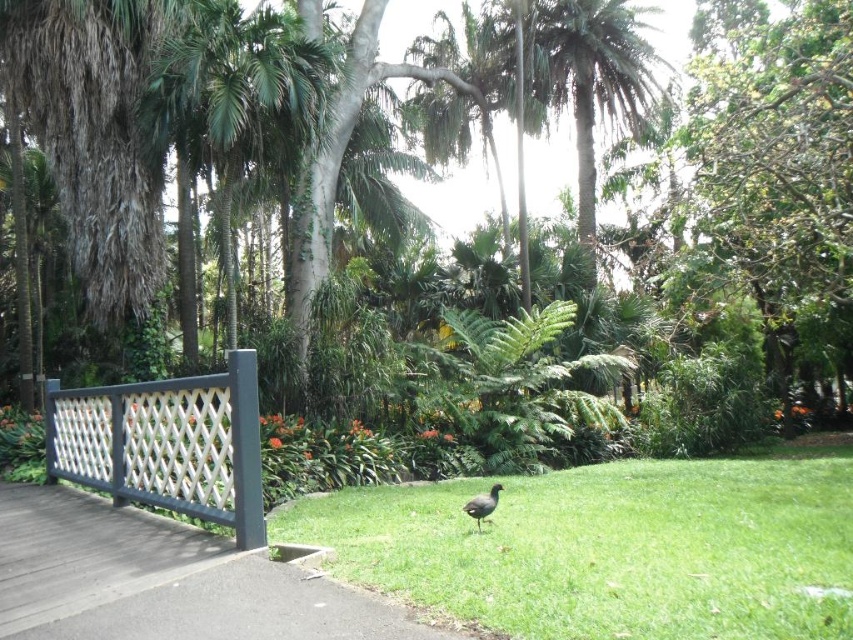
Does green grass at center have a lesser width compared to brown matte bird at center?

In fact, green grass at center might be wider than brown matte bird at center.

Can you confirm if green grass at center is bigger than brown matte bird at center?

Yes.

This screenshot has width=853, height=640. Describe the element at coordinates (610, 547) in the screenshot. I see `green grass at center` at that location.

The height and width of the screenshot is (640, 853). I want to click on green grass at center, so click(x=610, y=547).

The image size is (853, 640). Describe the element at coordinates (166, 444) in the screenshot. I see `white lattice fence at left` at that location.

Does point (149, 484) lie behind point (488, 496)?

Yes, it is behind point (488, 496).

Is point (256, 428) positioned in front of point (485, 508)?

That is True.

The image size is (853, 640). I want to click on white lattice fence at left, so click(x=166, y=444).

Does green grass at center appear over white lattice fence at left?

Incorrect, green grass at center is not positioned above white lattice fence at left.

Does green grass at center appear under white lattice fence at left?

Correct, green grass at center is located below white lattice fence at left.

Between point (671, 528) and point (199, 385), which one is positioned in front?

Point (199, 385)

I want to click on green grass at center, so click(x=610, y=547).